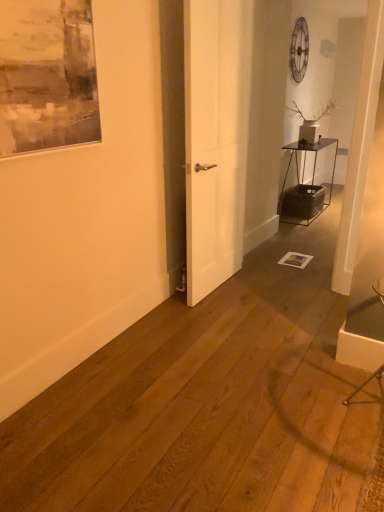
At what (x,y) coordinates should I click in order to perform the action: click on free space on the front side of white matte door at center. Please return your answer as a coordinate pair (x, y). Looking at the image, I should click on (222, 310).